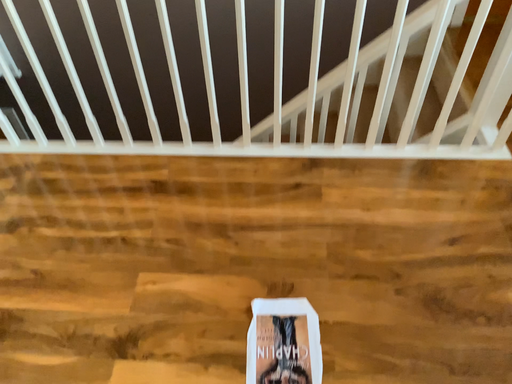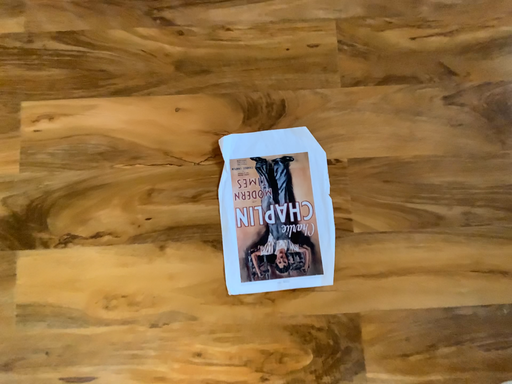
Question: Which way did the camera rotate in the video?

Choices:
 (A) rotated left
 (B) rotated right

Answer: (B)